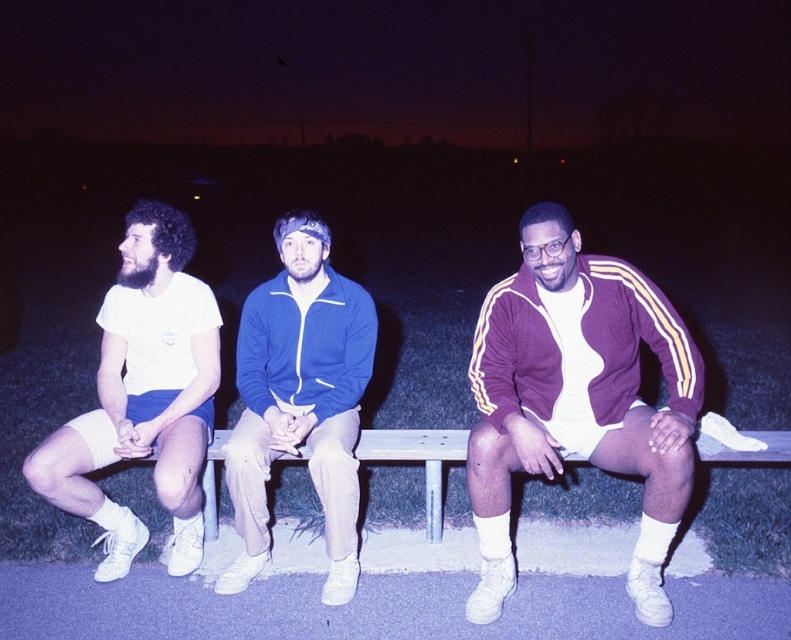
You are a photographer trying to capture a group photo of the three men on the wooden bench. You want to ensure that the purple velour tracksuit at center and the white matte shorts at left are clearly visible in the frame. Which clothing item should you focus on first to ensure it doesn

The purple velour tracksuit at center is smaller than the white matte shorts at left, so you should focus on the purple velour tracksuit at center first to ensure it is clearly visible in the frame.

You are a photographer trying to capture a group shot of the three men on the wooden bench. You want to ensure that the purple velour tracksuit at center and the blue fleece jacket at center are both visible in the frame. Based on their positions, which one should you focus on first to ensure both are in the shot?

The purple velour tracksuit at center is positioned on the right side of the blue fleece jacket at center. To ensure both are visible, focus on the blue fleece jacket at center first since it is on the left, allowing the photographer to frame from left to right, capturing both subjects in the shot.